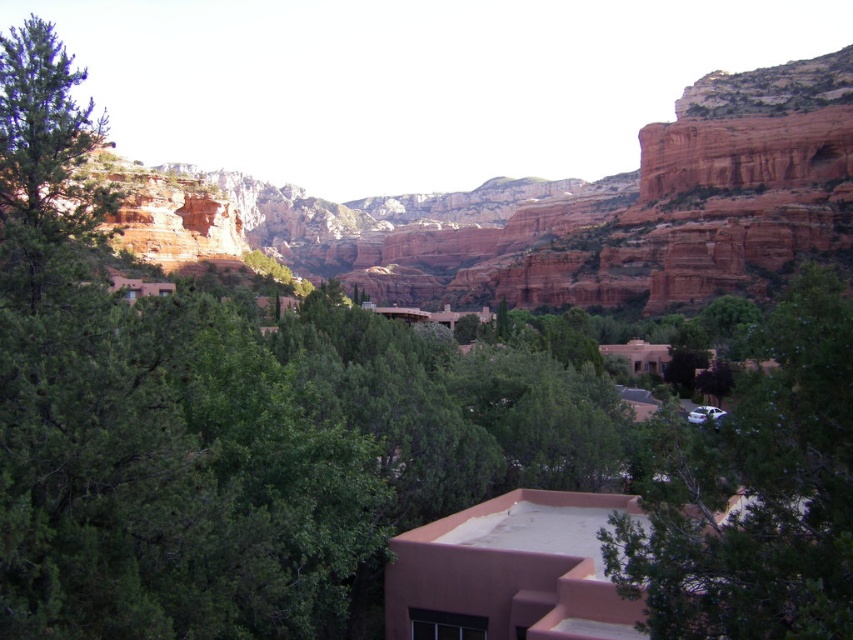
Which is behind, point (601, 237) or point (659, 433)?

Point (601, 237)

Between rustic rock formation at center and green leafy tree at center, which one has less height?

With less height is green leafy tree at center.

Consider the image. Who is more forward, [563,298] or [653,637]?

Point [653,637]

Locate an element on the screen. The image size is (853, 640). rustic rock formation at center is located at coordinates (608, 209).

Does rustic rock formation at center appear on the left side of green matte tree at left?

No, rustic rock formation at center is not to the left of green matte tree at left.

Is rustic rock formation at center wider than green matte tree at left?

Yes.

Who is more forward, (x=773, y=70) or (x=80, y=253)?

Positioned in front is point (x=80, y=253).

Where is `rustic rock formation at center`? The image size is (853, 640). rustic rock formation at center is located at coordinates (608, 209).

Who is higher up, green leafy tree at center or green matte tree at left?

Positioned higher is green matte tree at left.

Who is lower down, green leafy tree at center or green matte tree at left?

Positioned lower is green leafy tree at center.

The image size is (853, 640). What are the coordinates of `green leafy tree at center` in the screenshot? It's located at (755, 492).